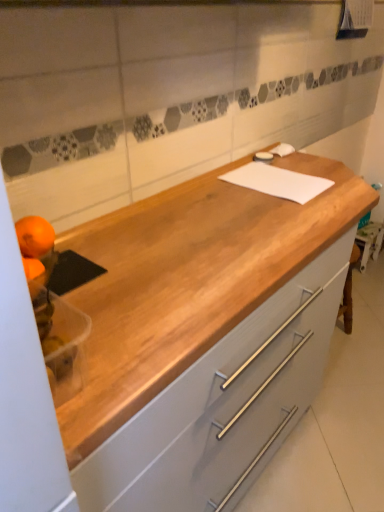
Question: Should I look upward or downward to see light gray wood cabinet at center?

Choices:
 (A) up
 (B) down

Answer: (B)

Question: Is white matte cutting board at center not inside orangesmoothfruit at left, which is the first orange from top to bottom?

Choices:
 (A) yes
 (B) no

Answer: (A)

Question: Does white matte cutting board at center have a greater width compared to orangesmoothfruit at left, which appears as the second orange when ordered from the bottom?

Choices:
 (A) no
 (B) yes

Answer: (B)

Question: Is there a large distance between white matte cutting board at center and orangesmoothfruit at left, which appears as the second orange when ordered from the bottom?

Choices:
 (A) yes
 (B) no

Answer: (B)

Question: From the image's perspective, is white matte cutting board at center located beneath orangesmoothfruit at left, which appears as the second orange when ordered from the bottom?

Choices:
 (A) yes
 (B) no

Answer: (B)

Question: Does white matte cutting board at center have a lesser width compared to orangesmoothfruit at left, which is the first orange from top to bottom?

Choices:
 (A) yes
 (B) no

Answer: (B)

Question: Does white matte cutting board at center have a larger size compared to orangesmoothfruit at left, which is the first orange from top to bottom?

Choices:
 (A) no
 (B) yes

Answer: (B)

Question: Does white matte cutting board at center have a greater height compared to light gray wood cabinet at center?

Choices:
 (A) no
 (B) yes

Answer: (A)

Question: From a real-world perspective, is white matte cutting board at center on light gray wood cabinet at center?

Choices:
 (A) no
 (B) yes

Answer: (B)

Question: Is the depth of white matte cutting board at center greater than that of light gray wood cabinet at center?

Choices:
 (A) no
 (B) yes

Answer: (B)

Question: Considering the relative sizes of white matte cutting board at center and light gray wood cabinet at center in the image provided, is white matte cutting board at center thinner than light gray wood cabinet at center?

Choices:
 (A) yes
 (B) no

Answer: (A)

Question: Are white matte cutting board at center and light gray wood cabinet at center located far from each other?

Choices:
 (A) no
 (B) yes

Answer: (A)

Question: Is white matte cutting board at center aimed at light gray wood cabinet at center?

Choices:
 (A) yes
 (B) no

Answer: (B)

Question: Can you confirm if orangesmoothfruit at left, which is the first orange from top to bottom, is thinner than orange matte at left, marked as the 2th orange in a top-to-bottom arrangement?

Choices:
 (A) yes
 (B) no

Answer: (B)